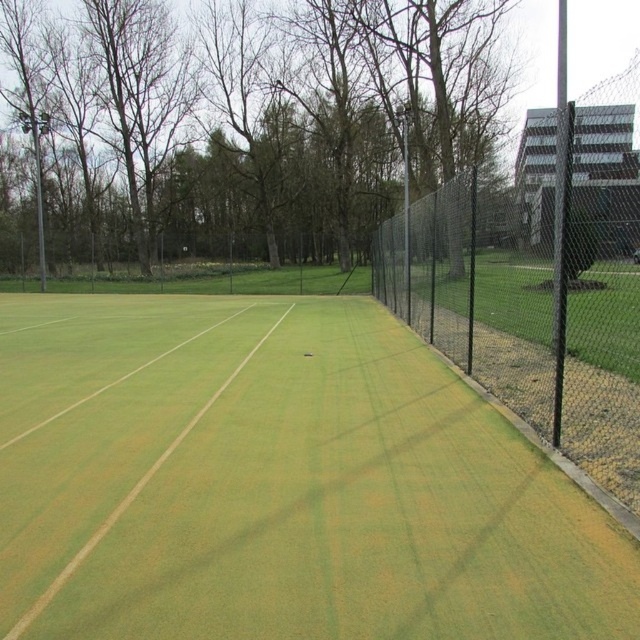
Question: Can you confirm if green turf at center is smaller than black chain-link fence at right?

Choices:
 (A) no
 (B) yes

Answer: (B)

Question: Which of the following is the closest to the observer?

Choices:
 (A) (449, 556)
 (B) (618, 493)

Answer: (A)

Question: Does green turf at center have a larger size compared to black chain-link fence at right?

Choices:
 (A) yes
 (B) no

Answer: (B)

Question: Which point is closer to the camera?

Choices:
 (A) black chain-link fence at right
 (B) green turf at center

Answer: (B)

Question: Is green turf at center wider than black chain-link fence at right?

Choices:
 (A) yes
 (B) no

Answer: (B)